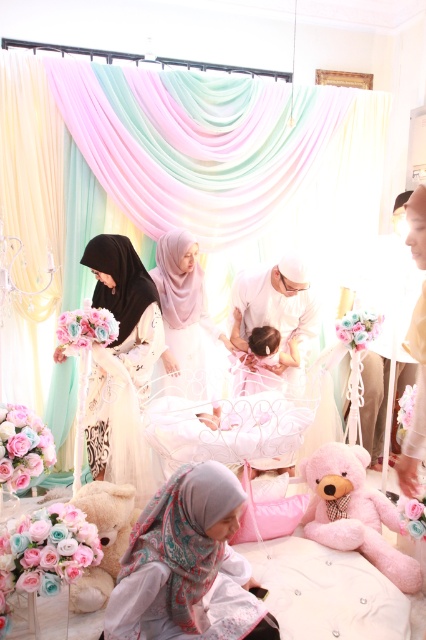
Question: Which of the following is the closest to the observer?

Choices:
 (A) pale pink fabric hijab at center
 (B) matte white dress at center
 (C) white lace dress at left
 (D) soft beige teddy bear at lower left

Answer: (A)

Question: Which of the following is the closest to the observer?

Choices:
 (A) pale pink fabric hijab at center
 (B) soft beige teddy bear at lower left
 (C) fluffy pink teddy bear at lower right

Answer: (A)

Question: Is fluffy pink teddy bear at lower right below matte white dress at center?

Choices:
 (A) no
 (B) yes

Answer: (B)

Question: Does white lace dress at left appear over soft beige teddy bear at lower left?

Choices:
 (A) yes
 (B) no

Answer: (A)

Question: From the image, what is the correct spatial relationship of pale pink fabric hijab at center in relation to white lace dress at left?

Choices:
 (A) below
 (B) above

Answer: (A)

Question: Which object appears closest to the camera in this image?

Choices:
 (A) fluffy pink teddy bear at lower right
 (B) matte white dress at center

Answer: (A)